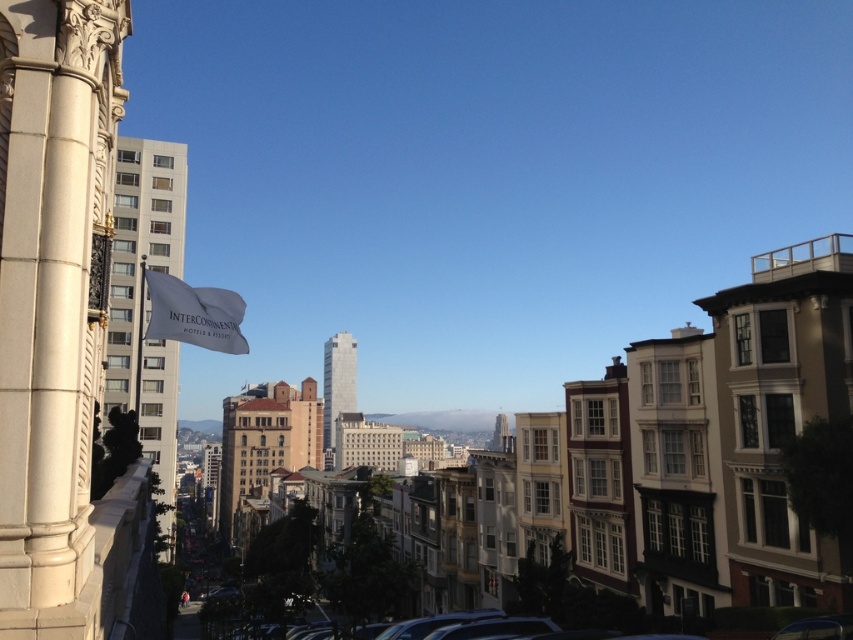
Question: Observing the image, what is the correct spatial positioning of white stone column at left in reference to white fabric flag at upper left?

Choices:
 (A) right
 (B) left

Answer: (A)

Question: Can you confirm if white stone column at left is positioned to the left of white fabric flag at upper left?

Choices:
 (A) yes
 (B) no

Answer: (B)

Question: Which object is farther from the camera taking this photo?

Choices:
 (A) white fabric flag at upper left
 (B) white stone column at left

Answer: (A)

Question: Which point appears farthest from the camera in this image?

Choices:
 (A) (212, 348)
 (B) (55, 428)

Answer: (A)

Question: Which object is closer to the camera taking this photo?

Choices:
 (A) white fabric flag at upper left
 (B) white stone column at left

Answer: (B)

Question: Can you confirm if white stone column at left is bigger than white fabric flag at upper left?

Choices:
 (A) yes
 (B) no

Answer: (B)